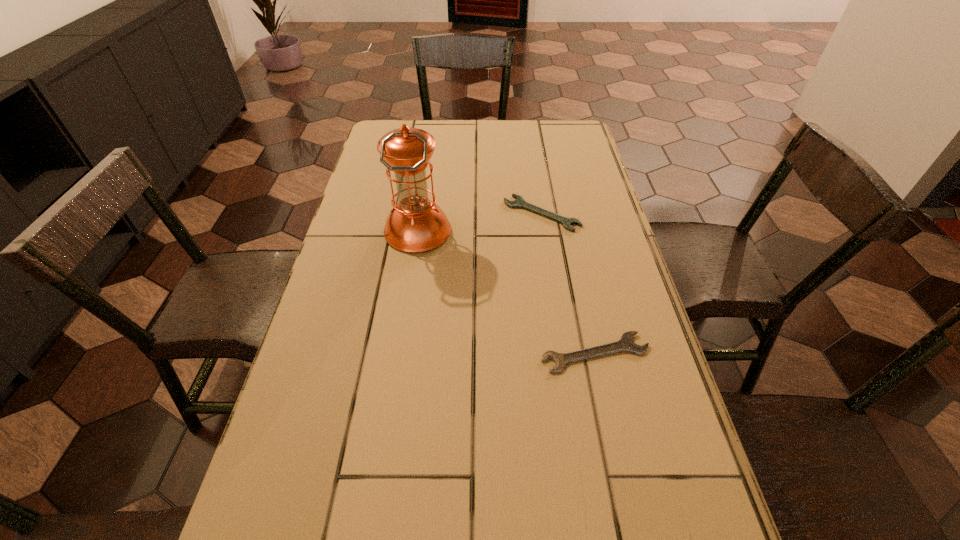
In order to click on free point between the nearest object and the farther wrench in this screenshot , I will do `click(568, 283)`.

Where is `free space between the nearest object and the farther wrench`? Image resolution: width=960 pixels, height=540 pixels. free space between the nearest object and the farther wrench is located at coordinates (568, 283).

The image size is (960, 540). I want to click on free spot between the nearer wrench and the oil lamp, so click(506, 292).

Identify the location of blank region between the oil lamp and the nearest object. The image size is (960, 540). (506, 292).

I want to click on free space between the nearer wrench and the farther wrench, so click(x=568, y=283).

You are a GUI agent. You are given a task and a screenshot of the screen. Output one action in this format:
    pyautogui.click(x=<x>, y=<y>)
    Task: Click on the vacant region between the farther wrench and the oil lamp
    
    Given the screenshot: What is the action you would take?
    pyautogui.click(x=480, y=222)

At what (x,y) coordinates should I click in order to perform the action: click on free space between the farther wrench and the nearer wrench. Please return your answer as a coordinate pair (x, y). This screenshot has height=540, width=960. Looking at the image, I should click on (568, 283).

The image size is (960, 540). I want to click on empty location between the tallest object and the nearest object, so point(506,292).

Image resolution: width=960 pixels, height=540 pixels. In order to click on free spot between the farther wrench and the leftmost object in this screenshot , I will do `click(480, 222)`.

The width and height of the screenshot is (960, 540). In order to click on vacant region between the nearer wrench and the farther wrench in this screenshot , I will do [568, 283].